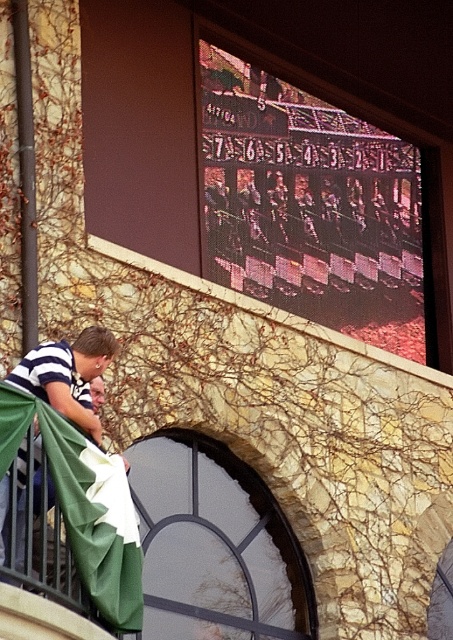
Does point (86, 378) lie behind point (117, 476)?

That is True.

Is point (19, 458) positioned in front of point (43, 492)?

No, (19, 458) is further to viewer.

This screenshot has width=453, height=640. Find the location of `striped cotton shirt at lower left`. striped cotton shirt at lower left is located at coordinates (68, 376).

I want to click on striped cotton shirt at lower left, so [68, 376].